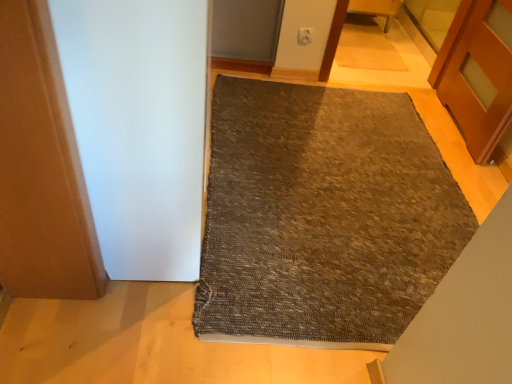
Find the location of `free point in front of white matte screen door at left`. free point in front of white matte screen door at left is located at coordinates (122, 332).